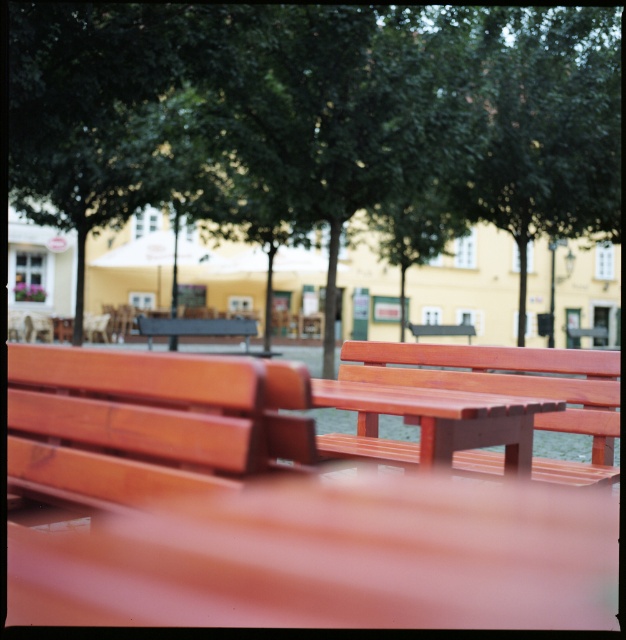
You are a photographer setting up equipment in the park. You need to place a 2.5 meter tall tripod between the green leafy tree at center and the wooden table at center. Considering their heights, will the tripod be taller than both objects?

The green leafy tree at center is taller than the wooden table at center. Since the tripod is 2.5 meters tall, it depends on the tree and table heights. However, the description only states the tree is taller than the table, but not their exact heights. Without specific measurements, we cannot confirm if the tripod will be taller than both.

You are a landscape architect designing a new park. You want to place a 12 meter long pathway between the green leafy tree at center and the wooden table at center. Is the distance sufficient to accommodate the pathway?

The distance between the green leafy tree at center and the wooden table at center is 10.68 meters, which is shorter than the required 12 meters for the pathway. Therefore, the existing space is insufficient to accommodate the 12 meter long pathway.